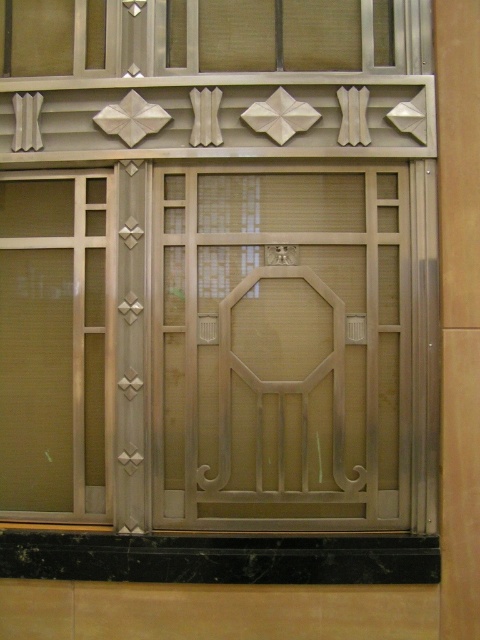
You are standing in front of an ornate architectural structure. There is a matte gold screen door at center. Where is the matte gold screen door located in relation to the central octagonal motif?

The matte gold screen door at center is located at point [280,348], which is the central octagonal motif.

You are an architect designing a new building and want to ensure proper spacing between the matte gold screen door at center and the brushed metal window at upper center. Given that the door has a lesser width than the window, which object should you consider adjusting the spacing around to maintain visual balance?

The matte gold screen door at center has a lesser width compared to the brushed metal window at upper center, so you should adjust the spacing around the door to make it wider or the window narrower to achieve visual balance.